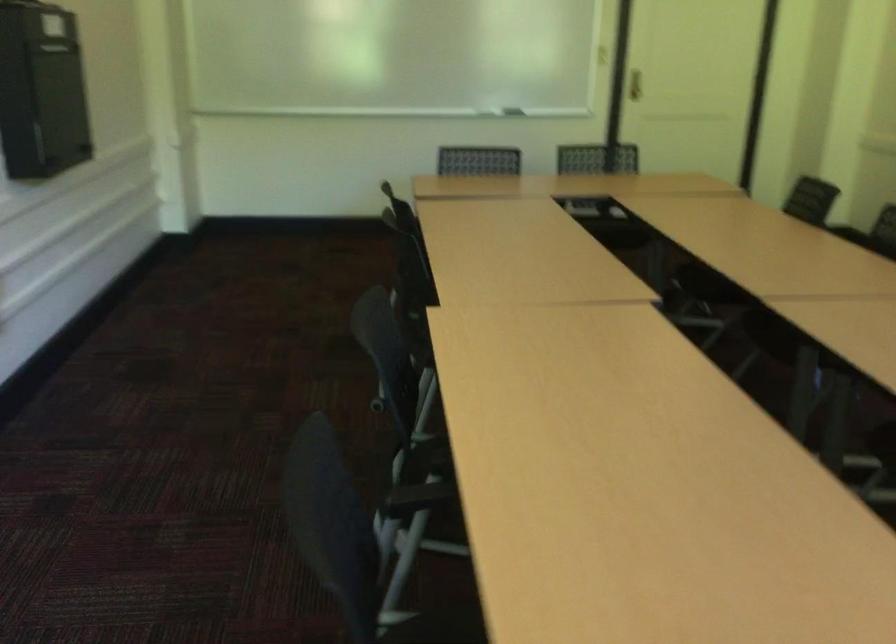
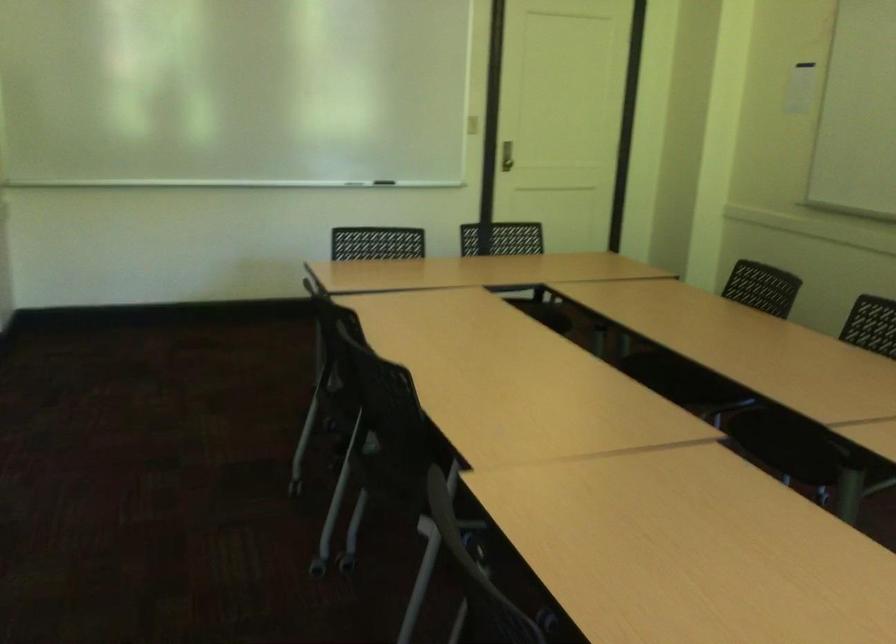
Question: How did the camera likely rotate?

Choices:
 (A) Left
 (B) Right
 (C) Up
 (D) Down

Answer: (B)